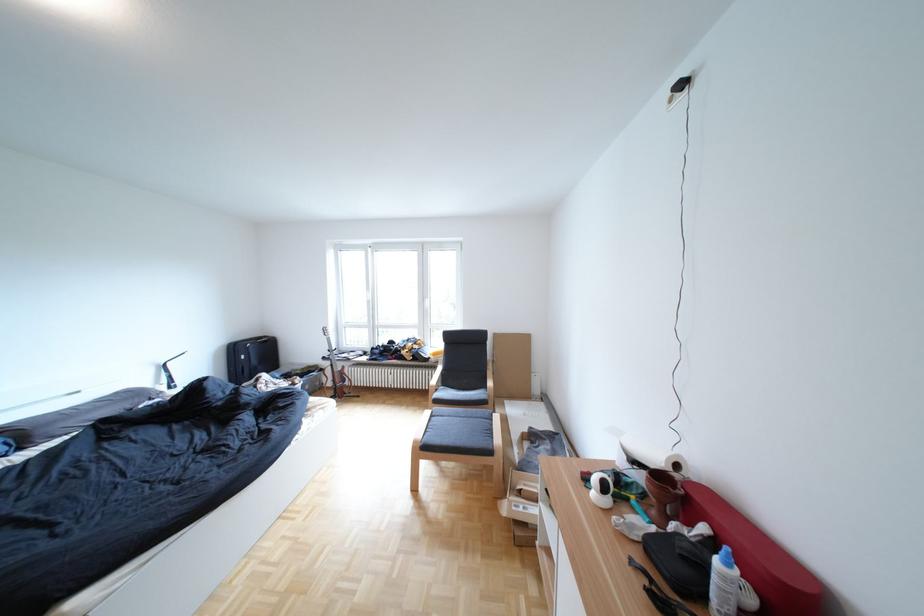
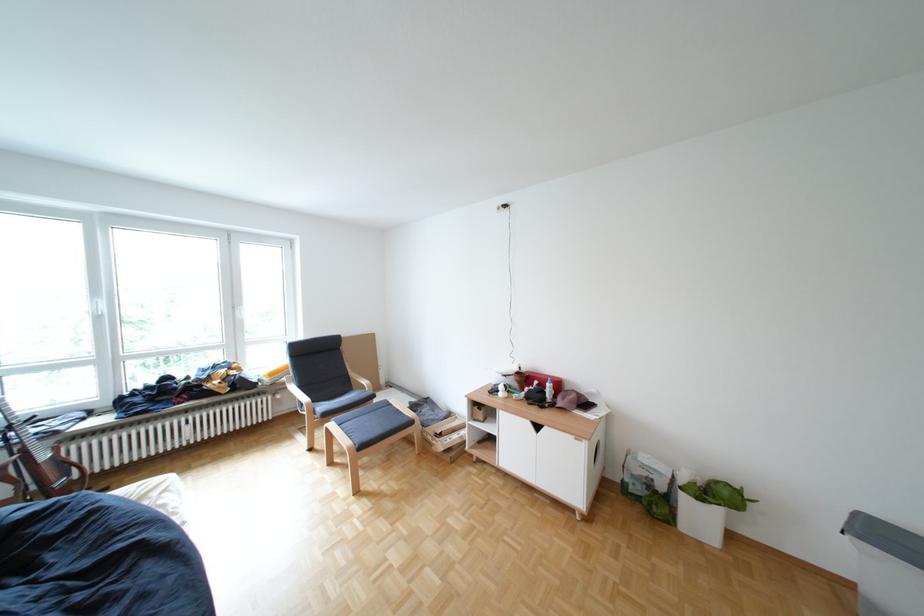
Find the pixel in the second image that matches pixel 719 529 in the first image.

(552, 383)